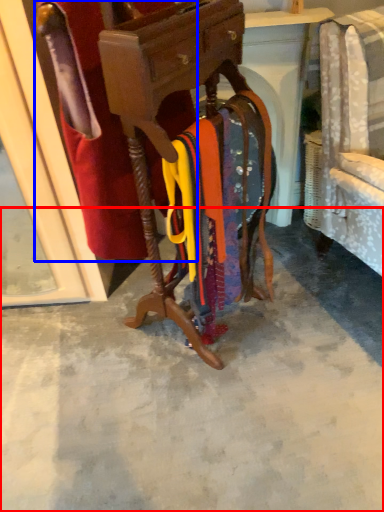
Question: Among these objects, which one is farthest to the camera, concrete (highlighted by a red box) or robe (highlighted by a blue box)?

Choices:
 (A) concrete
 (B) robe

Answer: (A)